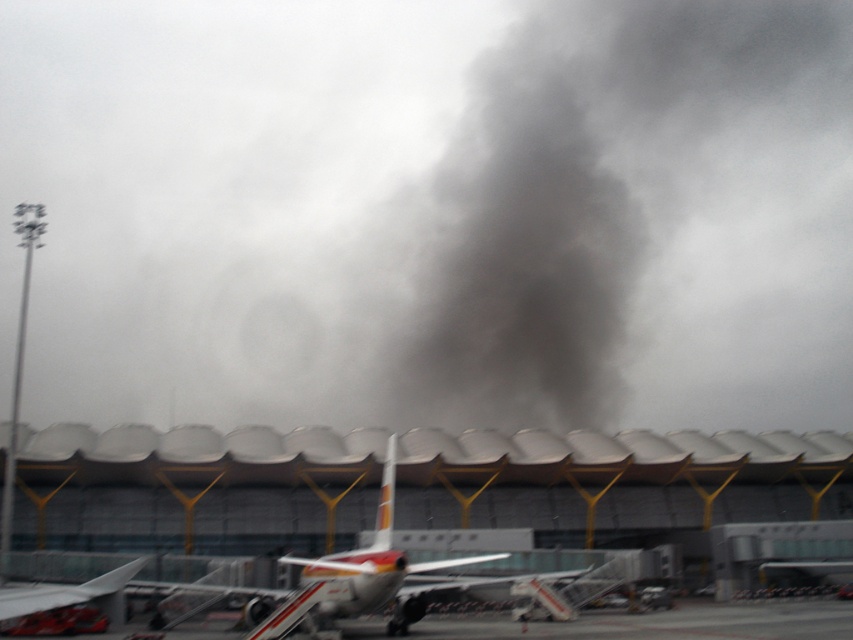
Looking at this image, you are a pilot preparing for takeoff and notice two smokes in the sky. You see the black smoke at upper center and the dark gray smoke at center. Which smoke is wider?

The black smoke at upper center is wider than the dark gray smoke at center.

You are a pilot observing the airport scene. You notice the dark gray smoke at center and the metallic silver airplane at center. Which object is positioned to the right of the other?

The dark gray smoke at center is to the right of the metallic silver airplane at center according to the description.

You are a pilot observing the airport scene. You notice the black smoke at upper center and the metallic silver airplane at center. Which object is closer to you?

The black smoke at upper center is closer to you than the metallic silver airplane at center because it is further to the viewer according to the description.